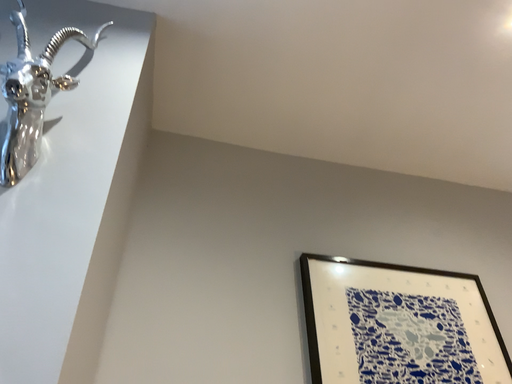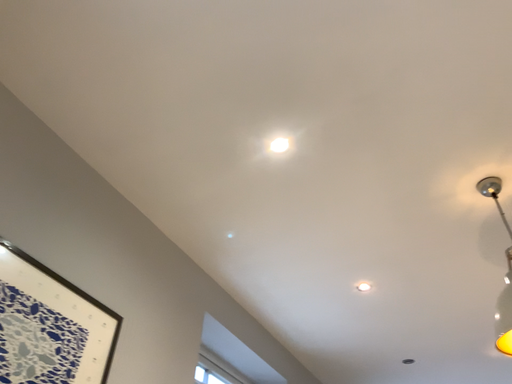
Question: How did the camera likely rotate when shooting the video?

Choices:
 (A) rotated downward
 (B) rotated upward

Answer: (A)